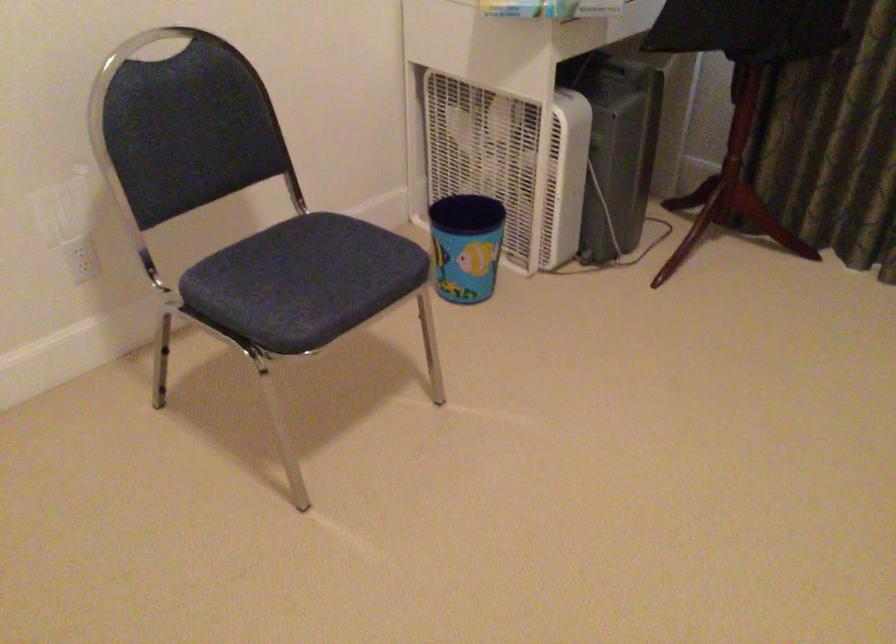
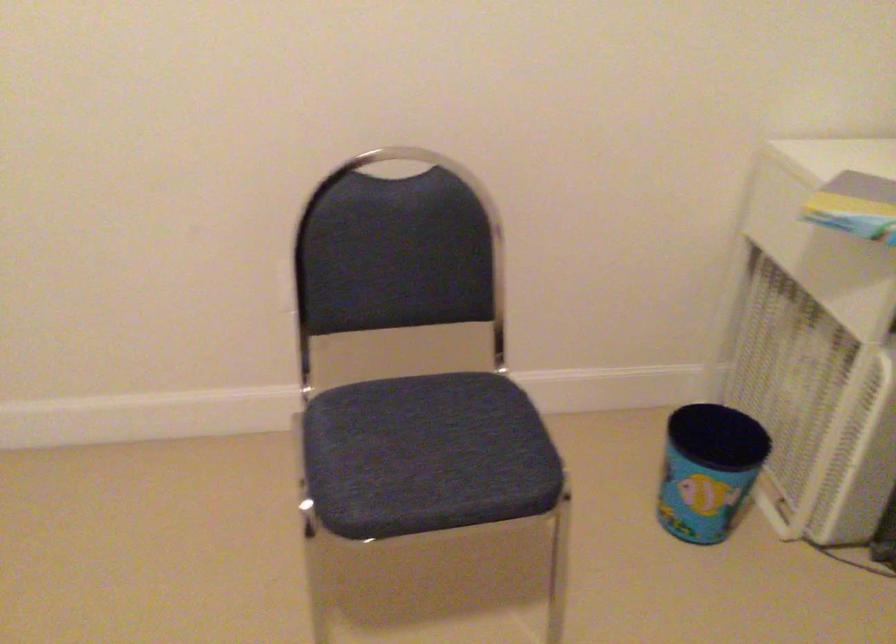
Locate, in the second image, the point that corresponds to point 474,234 in the first image.

(708, 469)